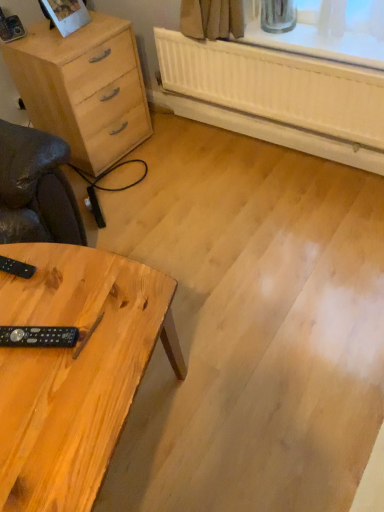
Identify the location of vacant area that lies to the right of black plastic remote at lower left, acting as the first control starting from the front. The image size is (384, 512). (103, 331).